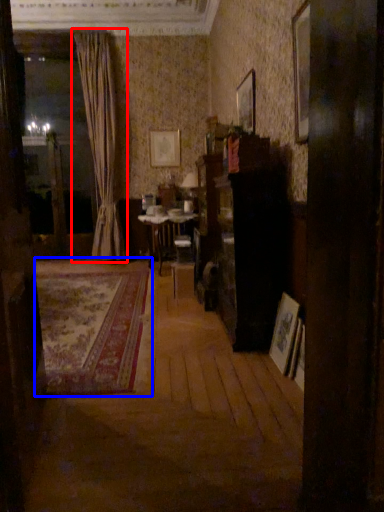
Question: Which object appears farthest to the camera in this image, curtain (highlighted by a red box) or plain (highlighted by a blue box)?

Choices:
 (A) curtain
 (B) plain

Answer: (A)